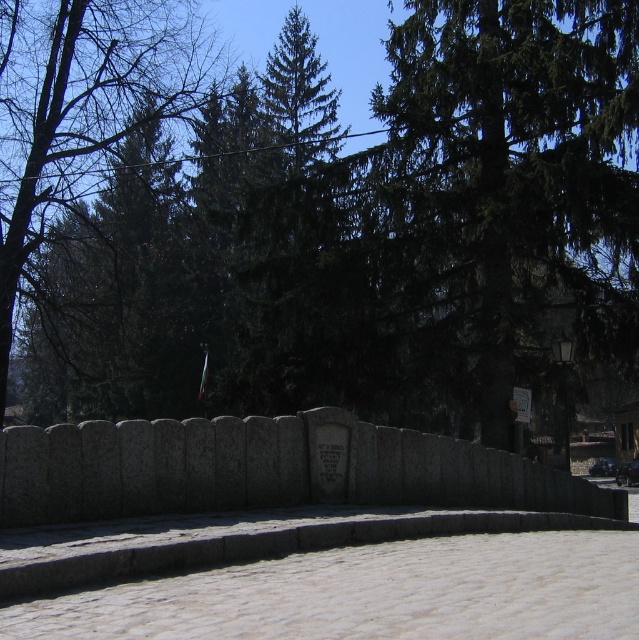
Question: From the image, what is the correct spatial relationship of green coniferous tree at center in relation to green leafy tree at upper left?

Choices:
 (A) left
 (B) right

Answer: (B)

Question: Which point is closer to the camera taking this photo?

Choices:
 (A) (10, 204)
 (B) (594, 186)

Answer: (B)

Question: Does dark green coniferous tree at center appear over green leafy tree at upper left?

Choices:
 (A) yes
 (B) no

Answer: (B)

Question: Which is nearer to the green leafy tree at upper left?

Choices:
 (A) green coniferous tree at center
 (B) dark green coniferous tree at center

Answer: (A)

Question: Which point is closer to the camera taking this photo?

Choices:
 (A) (50, 260)
 (B) (233, 321)
 (C) (449, 97)

Answer: (C)

Question: Is green coniferous tree at center behind dark green coniferous tree at center?

Choices:
 (A) no
 (B) yes

Answer: (B)